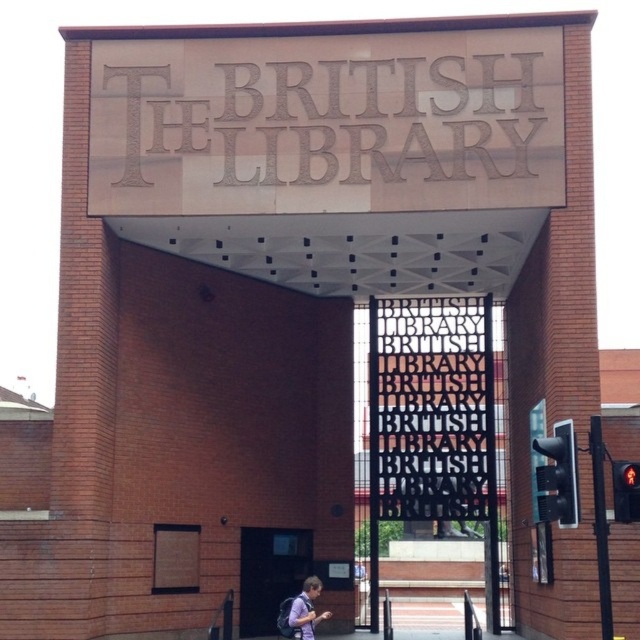
Does black matte door at lower center appear on the right side of purple fabric backpack at lower center?

No, black matte door at lower center is not to the right of purple fabric backpack at lower center.

Does black matte door at lower center lie behind purple fabric backpack at lower center?

Yes, black matte door at lower center is behind purple fabric backpack at lower center.

Between point (291, 544) and point (305, 634), which one is positioned behind?

The point (291, 544) is behind.

In order to click on black matte door at lower center in this screenshot , I will do `click(269, 573)`.

Does black metal sign at center have a larger size compared to black matte door at lower center?

Yes, black metal sign at center is bigger than black matte door at lower center.

Can you confirm if black metal sign at center is smaller than black matte door at lower center?

No.

Is point (456, 352) behind point (298, 560)?

Yes, it is.

Identify the location of black metal sign at center. This screenshot has height=640, width=640. (432, 426).

Who is positioned more to the left, matte stone sign at center or black metal sign at center?

matte stone sign at center is more to the left.

Is point (113, 192) closer to viewer compared to point (438, 506)?

Yes.

Image resolution: width=640 pixels, height=640 pixels. I want to click on matte stone sign at center, so click(326, 124).